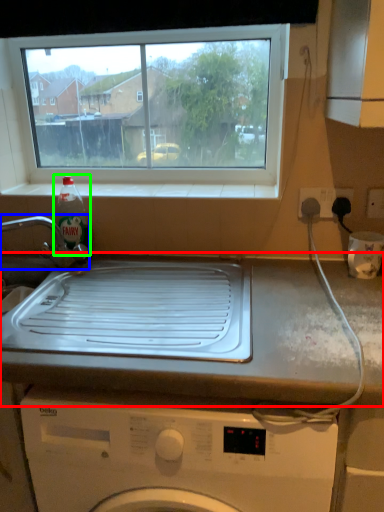
Question: Estimate the real-world distances between objects in this image. Which object is farther from countertop (highlighted by a red box), tap (highlighted by a blue box) or bottle (highlighted by a green box)?

Choices:
 (A) tap
 (B) bottle

Answer: (B)